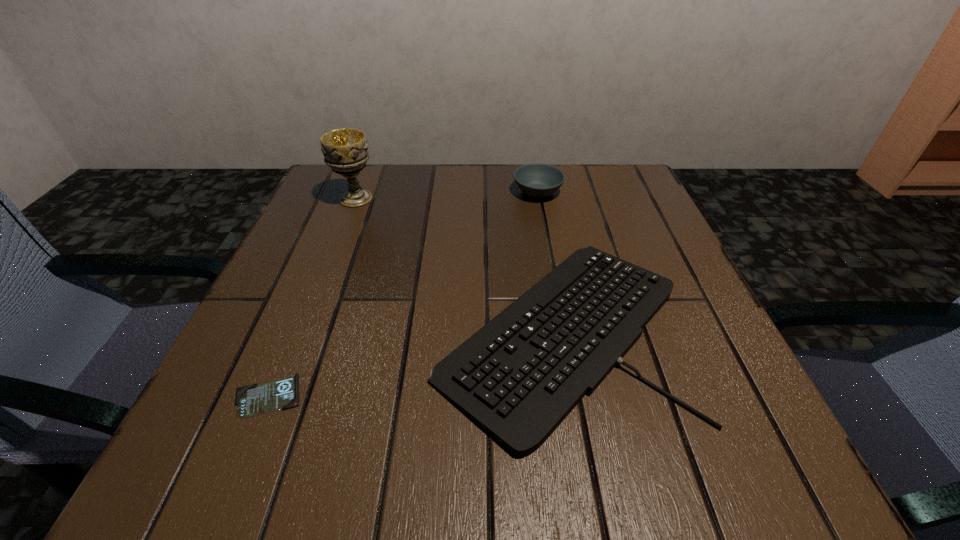
Where is `the tallest object`? the tallest object is located at coordinates (345, 150).

Locate an element on the screen. This screenshot has width=960, height=540. the third shortest object is located at coordinates (537, 180).

Find the location of a particular element. the third tallest object is located at coordinates (518, 377).

Identify the location of identity card. The width and height of the screenshot is (960, 540). [252, 400].

This screenshot has height=540, width=960. Find the location of `free space located 0.090m on the front of the chalice`. free space located 0.090m on the front of the chalice is located at coordinates (342, 234).

Find the location of a particular element. The width and height of the screenshot is (960, 540). vacant area situated 0.180m on the left of the second tallest object is located at coordinates (437, 192).

Find the location of a particular element. vacant point located 0.280m on the back of the third tallest object is located at coordinates (534, 178).

Where is `free location located 0.340m on the back of the identity card`? The width and height of the screenshot is (960, 540). free location located 0.340m on the back of the identity card is located at coordinates (333, 237).

Locate an element on the screen. The height and width of the screenshot is (540, 960). chalice present at the far edge is located at coordinates (345, 150).

Find the location of a particular element. The width and height of the screenshot is (960, 540). soup bowl that is positioned at the far edge is located at coordinates (537, 180).